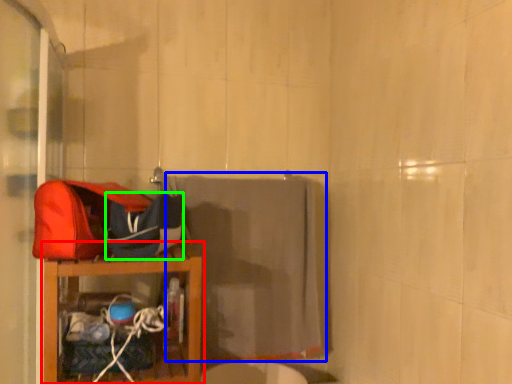
Question: Considering the real-world distances, which object is farthest from furniture (highlighted by a red box)? bath towel (highlighted by a blue box) or kit (highlighted by a green box)?

Choices:
 (A) bath towel
 (B) kit

Answer: (A)